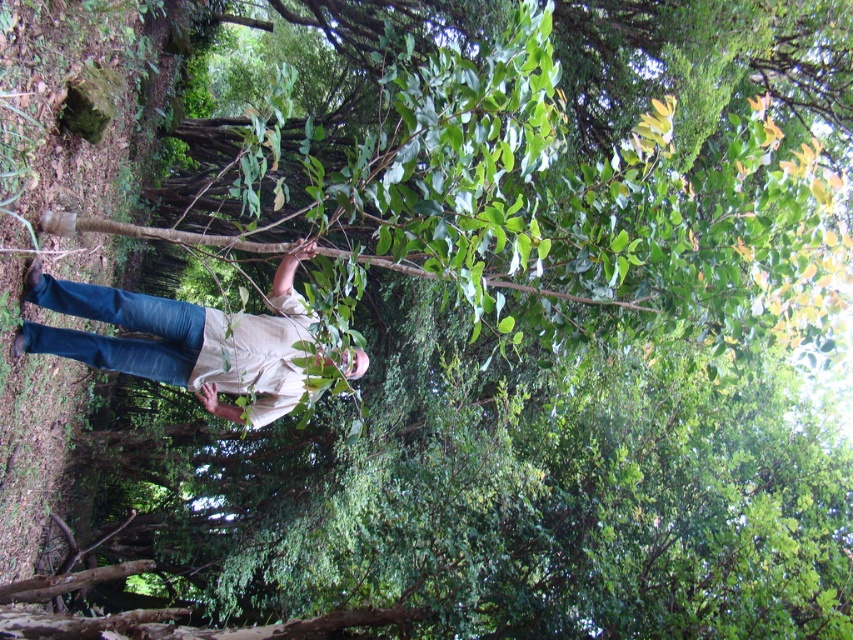
Is denim jeans at lower left shorter than brown rough tree branch at center?

Incorrect, denim jeans at lower left's height does not fall short of brown rough tree branch at center's.

What do you see at coordinates (183, 339) in the screenshot? I see `denim jeans at lower left` at bounding box center [183, 339].

Locate an element on the screen. denim jeans at lower left is located at coordinates (183, 339).